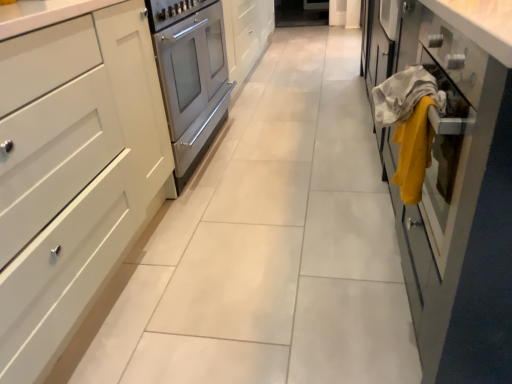
Question: Is point (403, 157) positioned closer to the camera than point (408, 86)?

Choices:
 (A) farther
 (B) closer

Answer: (A)

Question: Looking at their shapes, would you say yellow fabric at right, the 1th blanket when ordered from right to left, is wider or thinner than yellow fabric at right, positioned as the 2th blanket in right-to-left order?

Choices:
 (A) wide
 (B) thin

Answer: (B)

Question: Which object is the closest to the yellow fabric at right, the 1th blanket when ordered from right to left?

Choices:
 (A) matte glass cabinet at right, placed as the 1th cabinetry when sorted from right to left
 (B) white matte cabinet at left, which is the second cabinetry from right to left
 (C) yellow fabric at right, positioned as the 2th blanket in right-to-left order

Answer: (C)

Question: Which object is positioned closest to the yellow fabric at right, the second blanket from the left?

Choices:
 (A) yellow fabric at right, positioned as the 2th blanket in right-to-left order
 (B) matte glass cabinet at right, the second cabinetry when ordered from left to right
 (C) white matte cabinet at left, marked as the 1th cabinetry in a left-to-right arrangement

Answer: (A)